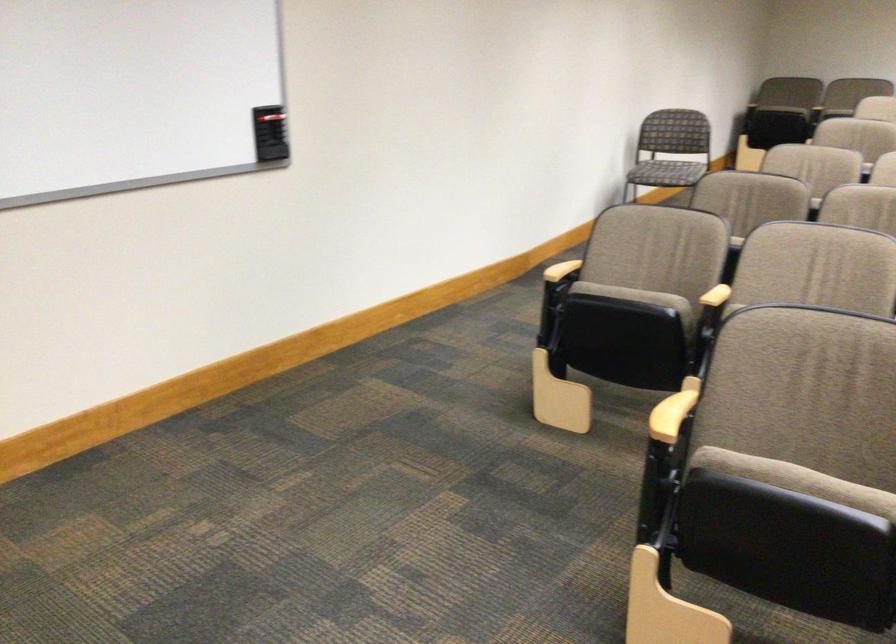
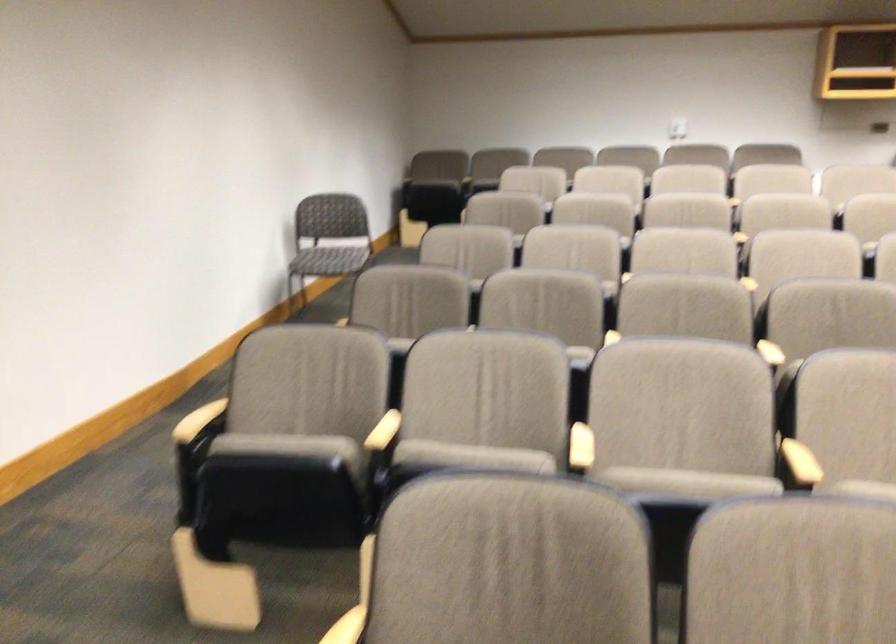
Question: The first image is from the beginning of the video and the second image is from the end. How did the camera likely rotate when shooting the video?

Choices:
 (A) Left
 (B) Right
 (C) Up
 (D) Down

Answer: (B)